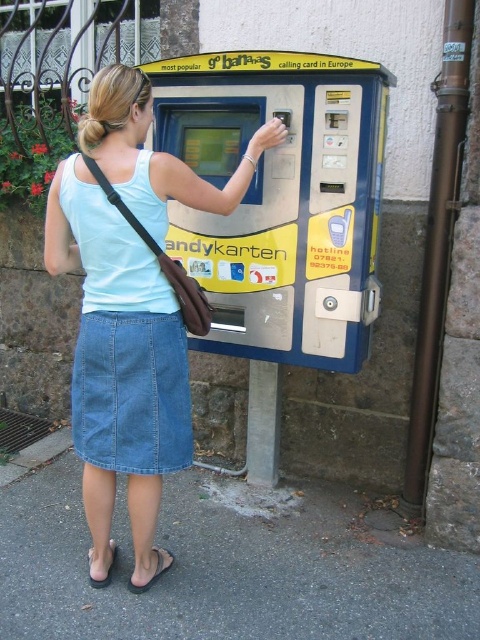
Is denim skirt at center in front of denim skirt at lower left?

Yes, it is.

The image size is (480, 640). What do you see at coordinates (120, 368) in the screenshot?
I see `denim skirt at center` at bounding box center [120, 368].

Does point (96, 500) come farther from viewer compared to point (147, 225)?

Yes, point (96, 500) is behind point (147, 225).

Locate an element on the screen. denim skirt at center is located at coordinates tap(120, 368).

Image resolution: width=480 pixels, height=640 pixels. What do you see at coordinates (280, 198) in the screenshot?
I see `yellow plastic vending machine at center` at bounding box center [280, 198].

Locate an element on the screen. yellow plastic vending machine at center is located at coordinates (280, 198).

Is yellow plastic vending machine at center positioned before denim skirt at center?

No, yellow plastic vending machine at center is behind denim skirt at center.

You are a GUI agent. You are given a task and a screenshot of the screen. Output one action in this format:
    pyautogui.click(x=<x>, y=<y>)
    Task: Click on the yellow plastic vending machine at center
    
    Given the screenshot: What is the action you would take?
    280,198

I want to click on yellow plastic vending machine at center, so click(x=280, y=198).